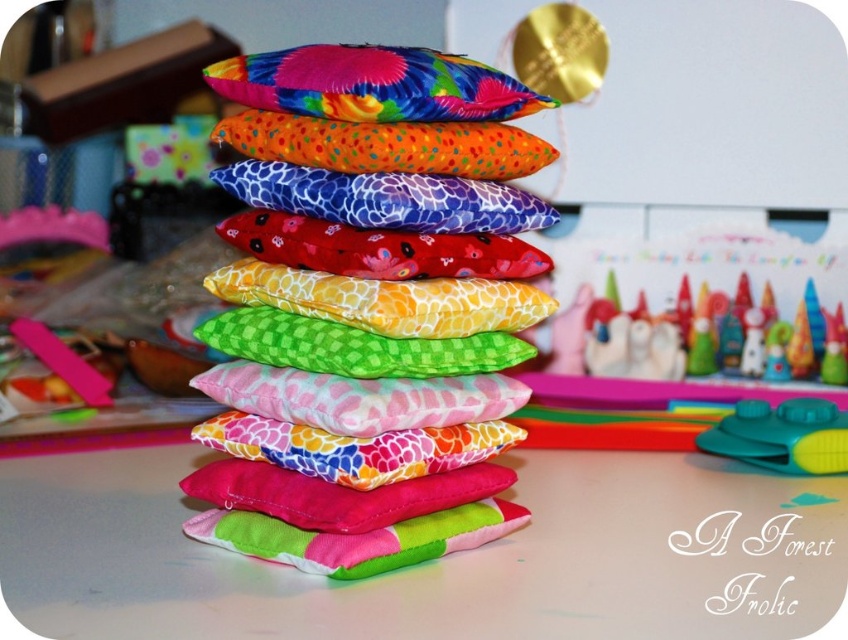
You are organizing a display of pillows and need to place a new pillow between the vibrant fabric pillows at center and the multicolored fabric pillow at upper center. Based on their positions, which side should you place the new pillow to ensure it aligns with the existing arrangement?

The vibrant fabric pillows at center is to the left of the multicolored fabric pillow at upper center, so you should place the new pillow to the right of the vibrant fabric pillows at center and to the left of the multicolored fabric pillow at upper center to maintain alignment.

Consider the image. You are organizing a display of pillows and need to place them in order from largest to smallest. Given the vibrant fabric pillows at center and the multicolored fabric pillow at upper center, which one should you place first in the sequence?

The vibrant fabric pillows at center should be placed first in the sequence because it is bigger than the multicolored fabric pillow at upper center.